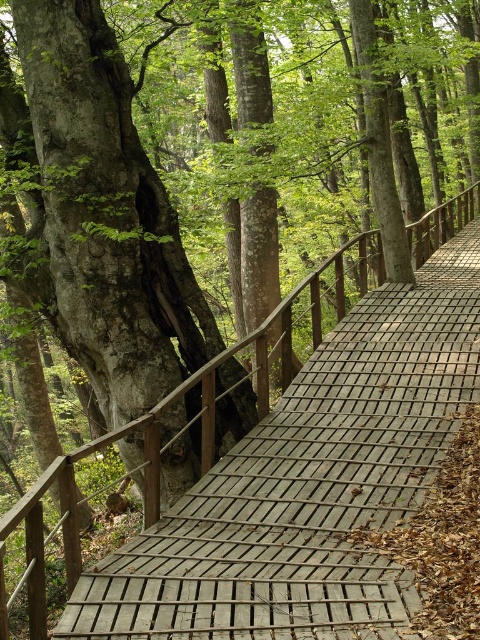
You are a hiker walking along the boardwalk and notice two landmarks ahead. The smooth gray bark at center and the wooden bridge at center. Which one is more to the left?

The smooth gray bark at center is positioned on the left side of wooden bridge at center, so it is more to the left.

You are standing on the wooden boardwalk and want to take a photo of the smooth gray bark at center and the wooden bridge at center. Which object should you point your camera downward to capture?

You should point your camera downward to capture the smooth gray bark at center because it is located below the wooden bridge at center.